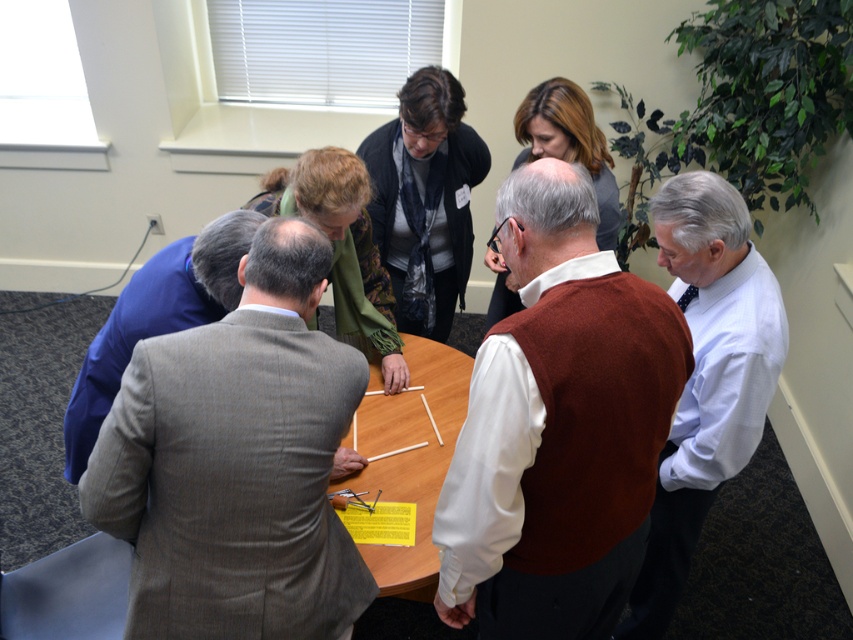
You are standing at the entrance of the room and want to greet the person in the gray wool suit at center. Which direction should you walk to approach them first before reaching the white shirt at center?

The gray wool suit at center is in front of the white shirt at center, so you should walk towards the gray wool suit at center first as it is closer to you from your current position at the entrance.

You are a photographer standing behind the group at the round table. You need to take a photo that includes both the gray wool suit at center and the white shirt at center. Which one should you position closer to the left side of the camera frame to ensure both are visible?

The gray wool suit at center is positioned on the left side of white shirt at center, so to include both in the photo, you should position the gray wool suit at center closer to the left side of the camera frame.

You are standing at the origin point of the coordinate system in the room. Where is the brown wool vest at center located in terms of its 2D coordinates?

The brown wool vest at center is located at the 2D coordinates of point [558,426].